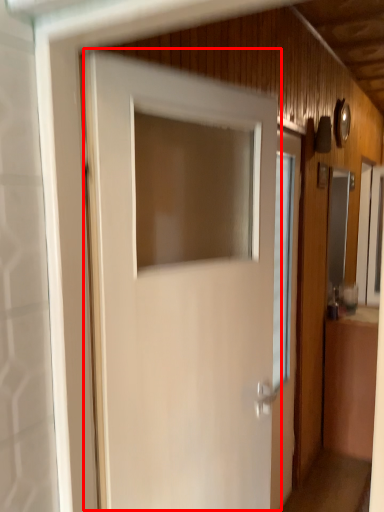
Question: In this image, where is door (annotated by the red box) located relative to window?

Choices:
 (A) left
 (B) right

Answer: (A)